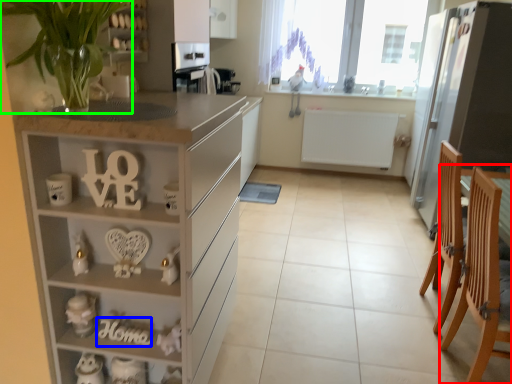
Question: Based on their relative distances, which object is nearer to armchair (highlighted by a red box)? Choose from alphabet (highlighted by a blue box) and plant (highlighted by a green box).

Choices:
 (A) alphabet
 (B) plant

Answer: (A)